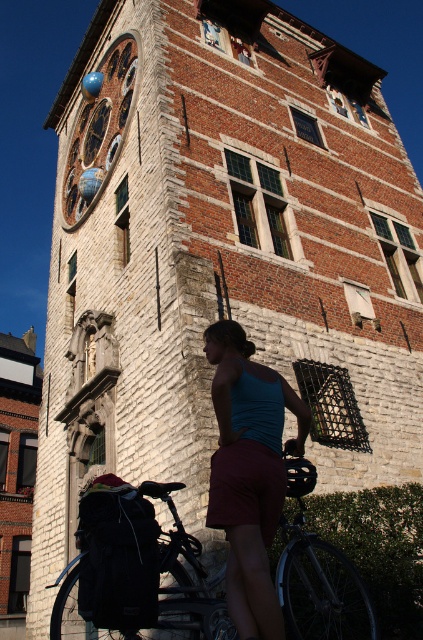
Which is more to the right, teal fabric tank top at center or blue glass clock at upper left?

From the viewer's perspective, teal fabric tank top at center appears more on the right side.

Is point (203, 346) positioned behind point (88, 150)?

No, it is not.

In order to click on teal fabric tank top at center in this screenshot , I will do `click(249, 472)`.

Is black matte bicycle at lower center behind blue glass clock at upper left?

No, it is not.

Measure the distance between black matte bicycle at lower center and camera.

black matte bicycle at lower center and camera are 18.34 meters apart.

The image size is (423, 640). What are the coordinates of `black matte bicycle at lower center` in the screenshot? It's located at point(318,576).

Can you confirm if black matte bicycle at lower center is thinner than teal fabric tank top at center?

No.

Is point (301, 621) positioned behind point (225, 474)?

Yes.

Identify the location of black matte bicycle at lower center. The height and width of the screenshot is (640, 423). (318, 576).